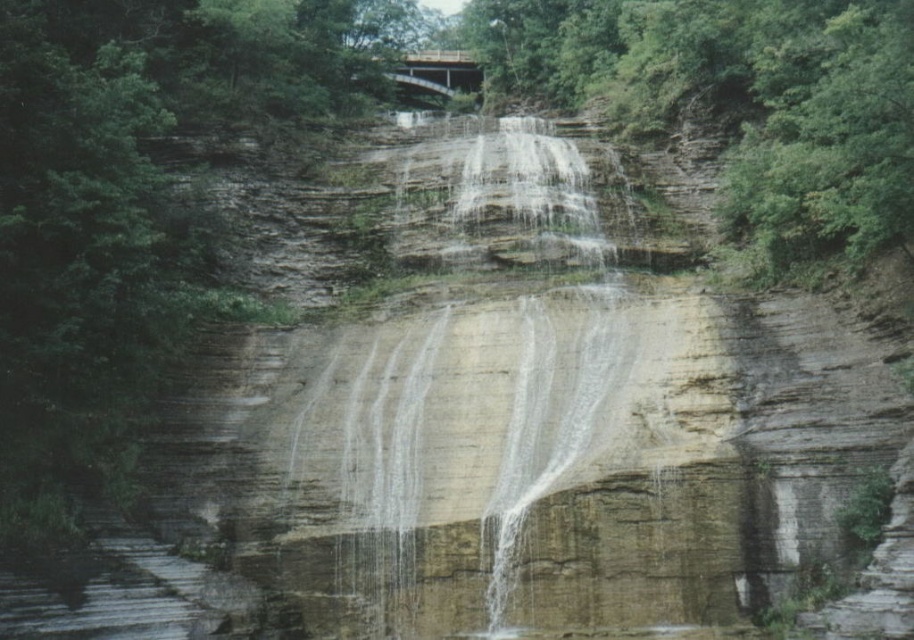
You are a hiker who wants to cross the wooden bridge at upper center to get to the other side. However, you notice the white textured water at center flowing nearby. Is the water flowing to the right or left of the bridge?

The white textured water at center is flowing to the right of the wooden bridge at upper center.

You are a hiker planning to cross the wooden bridge at upper center. You notice the white textured water at center below the bridge. Based on the scene, can you determine if the bridge is wide enough to safely walk across?

The white textured water at center is wider than the wooden bridge at upper center. Since the bridge is narrower than the water below it, there might be enough space to walk across the bridge safely, but you should be cautious as the bridge is narrower than the water width.